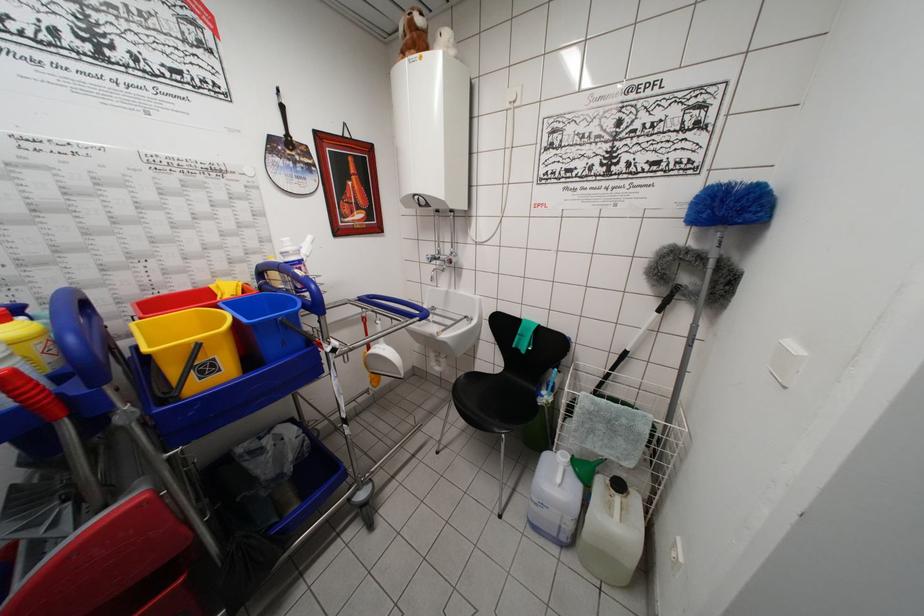
Where would you sit the black chair sitting surface? Please return your answer as a coordinate pair (x, y).

(496, 392)